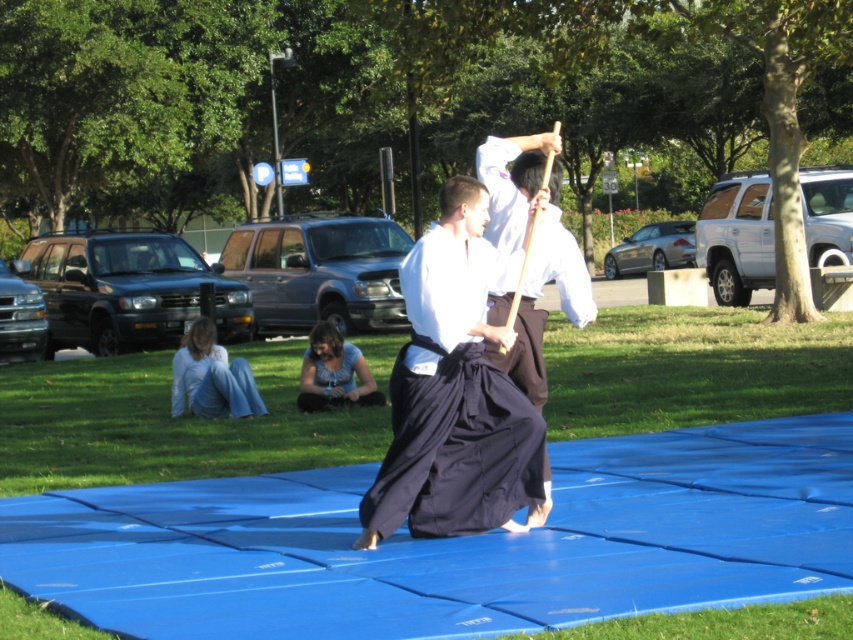
Question: Which of the following is the closest to the observer?

Choices:
 (A) white cotton kimono at center
 (B) light blue cotton pants at lower left
 (C) black cotton kimono at center
 (D) blue denim jeans at lower center

Answer: (C)

Question: Can you confirm if white cotton kimono at center is positioned above blue denim jeans at lower center?

Choices:
 (A) yes
 (B) no

Answer: (A)

Question: Considering the relative positions of white cotton kimono at center and light blue cotton pants at lower left in the image provided, where is white cotton kimono at center located with respect to light blue cotton pants at lower left?

Choices:
 (A) right
 (B) left

Answer: (A)

Question: Which point is farther to the camera?

Choices:
 (A) white cotton kimono at center
 (B) light blue cotton pants at lower left
 (C) black cotton kimono at center
 (D) blue denim jeans at lower center

Answer: (D)

Question: Which of the following is the closest to the observer?

Choices:
 (A) (245, 371)
 (B) (428, 477)

Answer: (B)

Question: Does black cotton kimono at center appear on the left side of blue denim jeans at lower center?

Choices:
 (A) no
 (B) yes

Answer: (A)